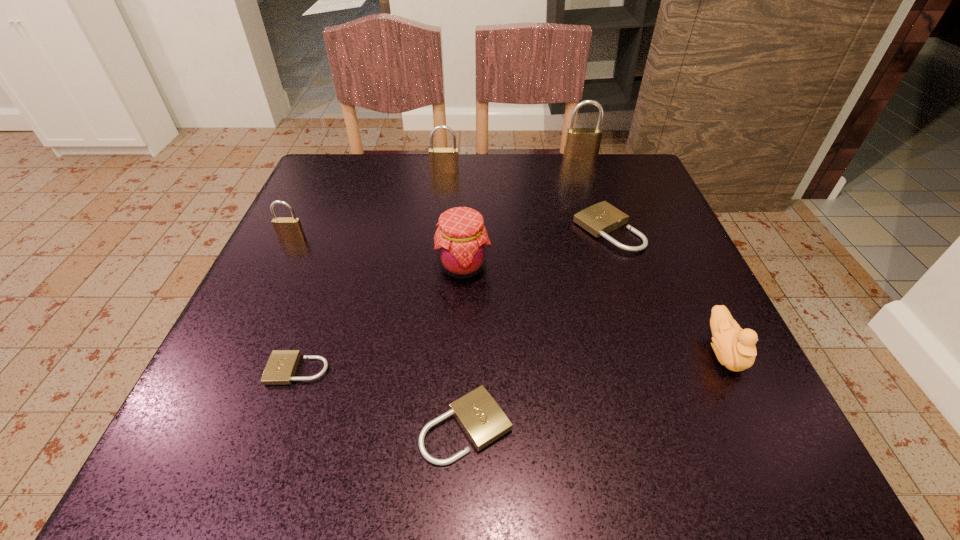
Identify the location of free space between the biggest beige padlock and the red jam. (536, 248).

Identify the location of free space between the red jam and the second biggest beige padlock. (465, 346).

Locate an element on the screen. This screenshot has height=540, width=960. free space that is in between the jam and the rightmost object is located at coordinates (593, 308).

At what (x,y) coordinates should I click in order to perform the action: click on vacant point located between the third shortest padlock and the farthest padlock. Please return your answer as a coordinate pair (x, y). This screenshot has height=540, width=960. Looking at the image, I should click on (594, 193).

You are a GUI agent. You are given a task and a screenshot of the screen. Output one action in this format:
    pyautogui.click(x=<x>, y=<y>)
    Task: Click on the unoccupied position between the third tallest padlock and the red jam
    This screenshot has width=960, height=540.
    Given the screenshot: What is the action you would take?
    pyautogui.click(x=377, y=252)

Image resolution: width=960 pixels, height=540 pixels. Identify the location of free space between the third shortest object and the fifth nearest padlock. (526, 201).

Locate an element on the screen. The image size is (960, 540). free point between the duckling and the biggest beige padlock is located at coordinates (665, 291).

Find the location of a particular element. vacant area that lies between the third tallest padlock and the jam is located at coordinates (377, 252).

Where is `blank region between the shortest object and the seventh nearest object`? Image resolution: width=960 pixels, height=540 pixels. blank region between the shortest object and the seventh nearest object is located at coordinates (372, 271).

Identify which object is the sixth nearest to the second farthest padlock. Please provide its 2D coordinates. Your answer should be formatted as a tuple, i.e. [(x, y)], where the tuple contains the x and y coordinates of a point satisfying the conditions above.

[(479, 415)]